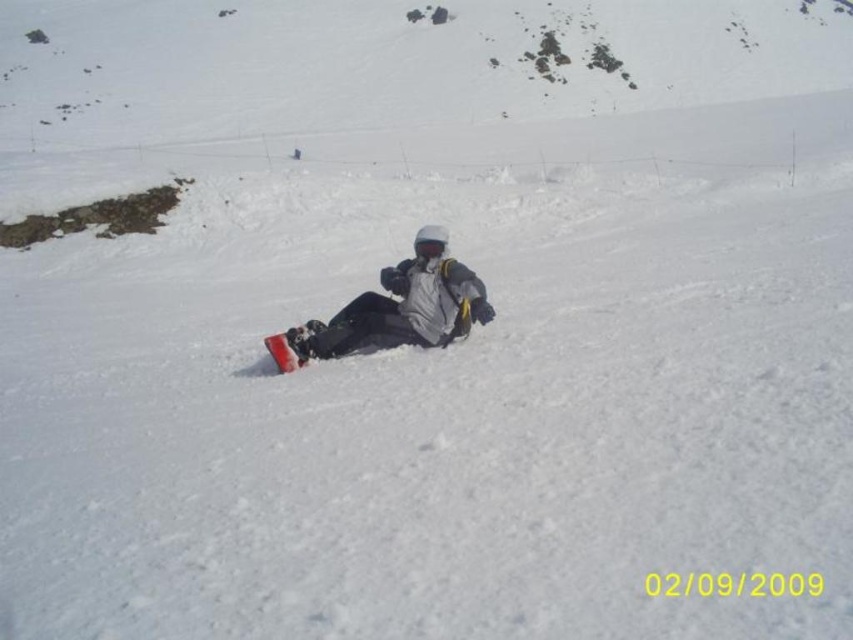
You are a photographer trying to capture the best angle of the snowboarder. You notice two points marked on your camera screen at coordinates point (397,301) and point (286,358). Which point is closer to your camera lens?

Point (397,301) is further to the viewer than point (286,358), so the point closer to the camera lens is point (286,358).

You are a snowboarder who wants to retrieve your snowboard. You see a matte gray snowboard at center and a matte red snowboard at center. Which one is closer to you?

The matte gray snowboard at center is 75.96 centimeters away from the matte red snowboard at center, so the one closer to you would depend on your position. However, since both are at the center, they are equidistant from you.

You are a photographer standing at the camera position. You want to take a closeup photo of the matte gray snowboard at center. The camera can focus on objects within 5 meters. Can you take the photo without moving closer?

The matte gray snowboard at center is 7.43 meters away from the camera, which is beyond the camera focus range of 5 meters. Therefore, you cannot take the closeup photo without moving closer.